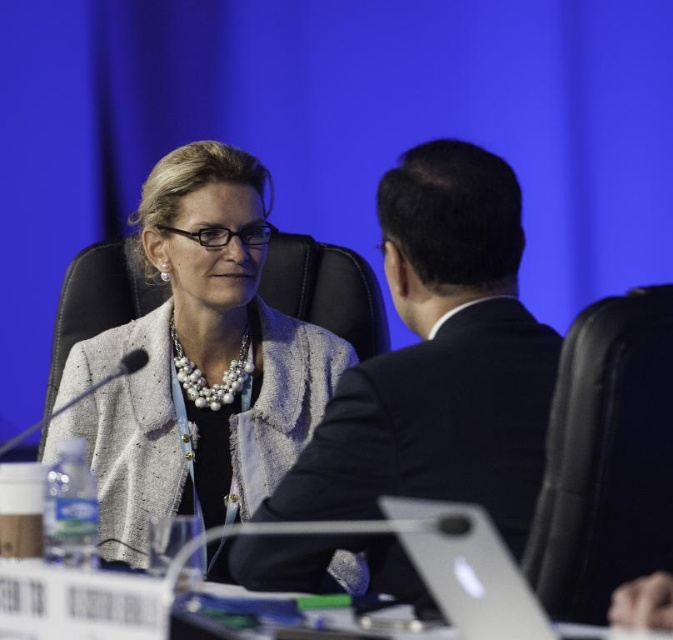
In the scene shown: You are organizing a photo shoot and need to ensure that the matte gray blazer at center and the silver metallic laptop at center are both visible in the frame. Given their sizes, which object should you prioritize positioning closer to the camera to maintain clarity?

The matte gray blazer at center is wider than the silver metallic laptop at center, so you should prioritize positioning the matte gray blazer at center closer to the camera to maintain clarity.

You are organizing a photo shoot and need to ensure that all participants are visible in the frame. Given the dark suit at center and the matte gray blazer at center, which one takes up more space in the image?

The matte gray blazer at center takes up more space in the image since the dark suit at center occupies less space than it.